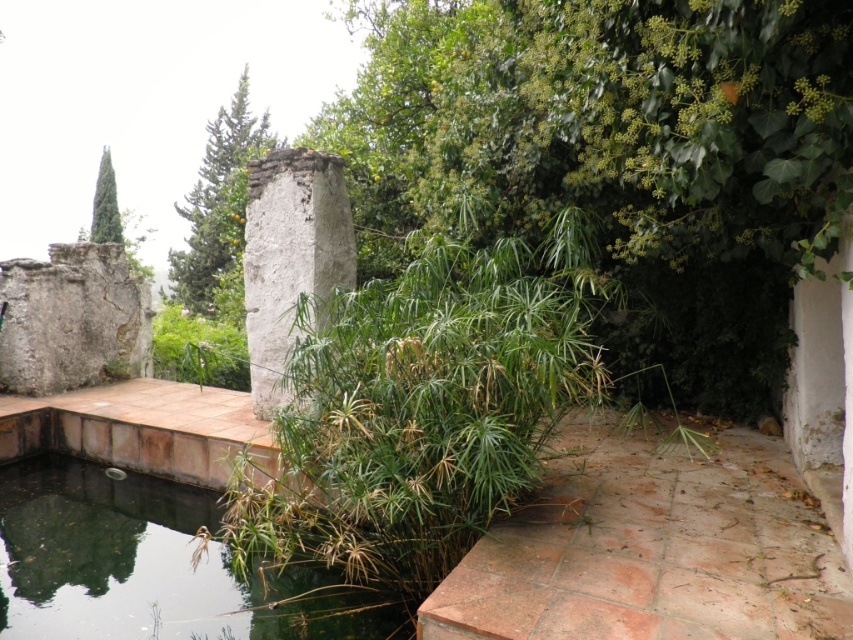
Does point (78, 577) come in front of point (345, 211)?

Yes.

In order to click on transparent water at center in this screenshot , I will do `click(138, 564)`.

Where is `transparent water at center`? The width and height of the screenshot is (853, 640). transparent water at center is located at coordinates (138, 564).

Find the location of a particular element. The height and width of the screenshot is (640, 853). transparent water at center is located at coordinates (138, 564).